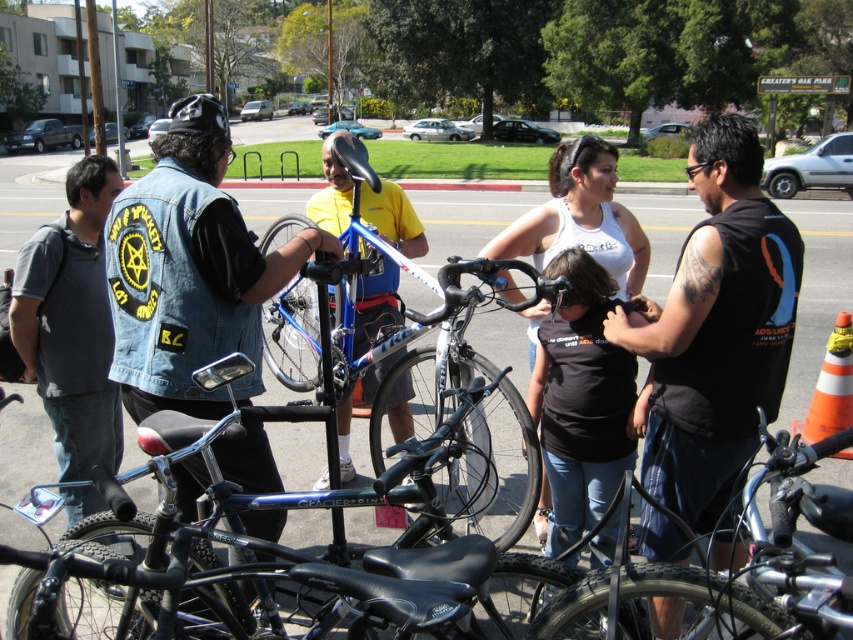
Question: Does black sleeveless shirt at right appear under shiny black bike at center?

Choices:
 (A) no
 (B) yes

Answer: (A)

Question: Considering the real-world distances, which object is closest to the denim vest at center?

Choices:
 (A) shiny blue bicycle at center
 (B) shiny black bike at center
 (C) shiny blue bike at center
 (D) dark gray shirt at left

Answer: (C)

Question: Which object appears farthest from the camera in this image?

Choices:
 (A) shiny blue bicycle at center
 (B) shiny blue bike at center

Answer: (A)

Question: Is denim vest at center wider than shiny blue bicycle at center?

Choices:
 (A) yes
 (B) no

Answer: (A)

Question: Observing the image, what is the correct spatial positioning of shiny black bike at center in reference to shiny blue bicycle at center?

Choices:
 (A) left
 (B) right

Answer: (B)

Question: Among these objects, which one is farthest from the camera?

Choices:
 (A) shiny black bike at center
 (B) black matte shirt at center
 (C) black sleeveless shirt at right
 (D) shiny blue bike at center

Answer: (B)